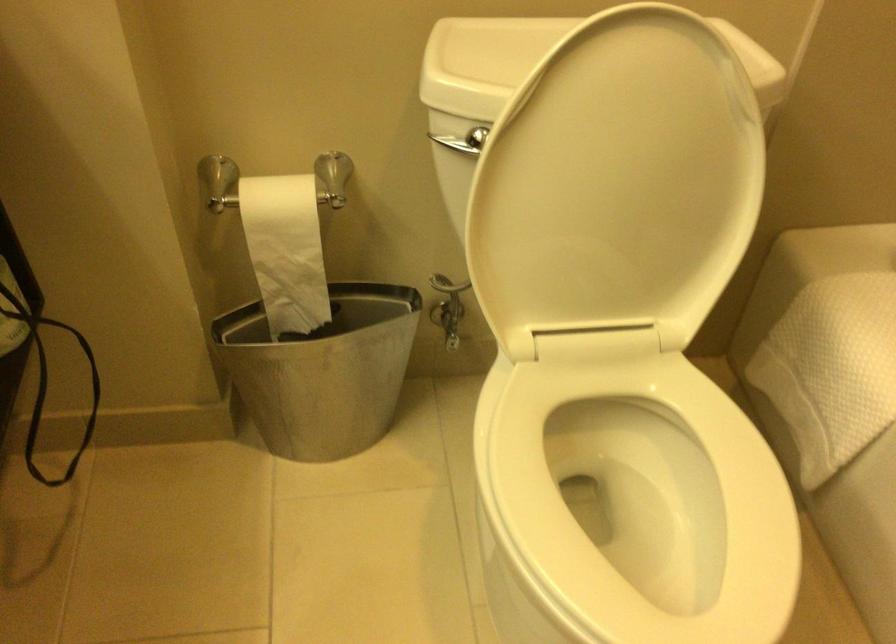
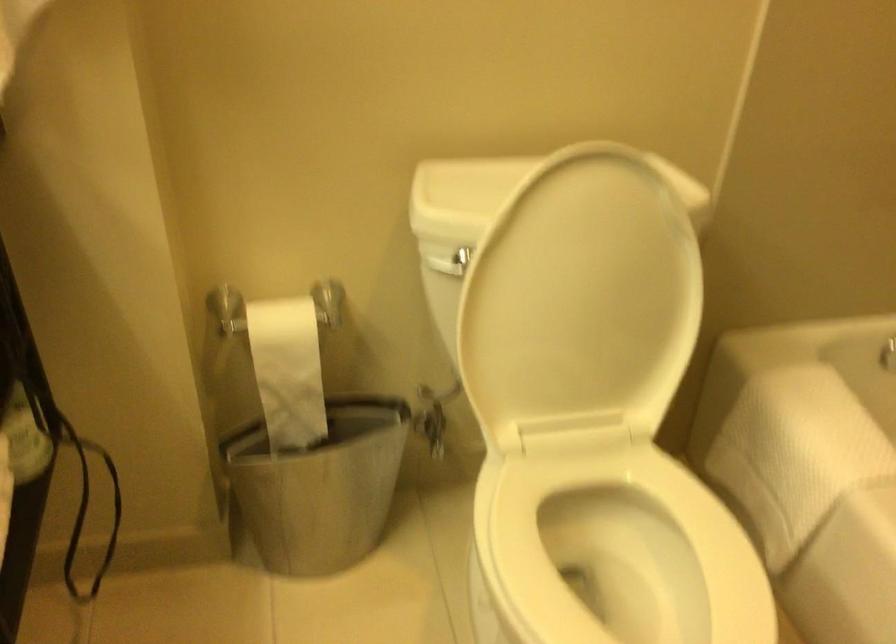
The point at (x=616, y=190) is marked in the first image. Where is the corresponding point in the second image?

(581, 301)